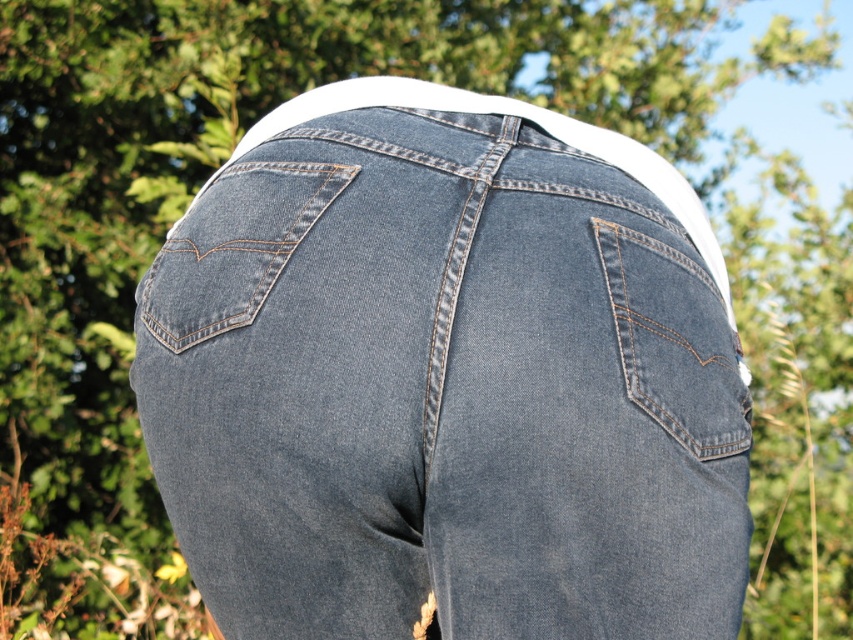
Does denim pocket at right appear on the right side of denim at left?

Correct, you'll find denim pocket at right to the right of denim at left.

Is denim pocket at right in front of denim at left?

That is True.

Between point (705, 320) and point (329, 182), which one is positioned in front?

Point (329, 182)

Where is `denim pocket at right`? denim pocket at right is located at coordinates (674, 340).

Is point (206, 225) farther from camera compared to point (624, 236)?

Yes, it is behind point (624, 236).

From the picture: Is denim at center above denim pocket at right?

No.

Image resolution: width=853 pixels, height=640 pixels. What do you see at coordinates (444, 392) in the screenshot? I see `denim at center` at bounding box center [444, 392].

Image resolution: width=853 pixels, height=640 pixels. I want to click on denim at center, so click(444, 392).

Does denim at center lie in front of denim at left?

Yes, denim at center is in front of denim at left.

Describe the element at coordinates (444, 392) in the screenshot. I see `denim at center` at that location.

What do you see at coordinates (444, 392) in the screenshot? Image resolution: width=853 pixels, height=640 pixels. I see `denim at center` at bounding box center [444, 392].

You are a GUI agent. You are given a task and a screenshot of the screen. Output one action in this format:
    pyautogui.click(x=<x>, y=<y>)
    Task: Click on the denim at center
    The height and width of the screenshot is (640, 853).
    Given the screenshot: What is the action you would take?
    (x=444, y=392)